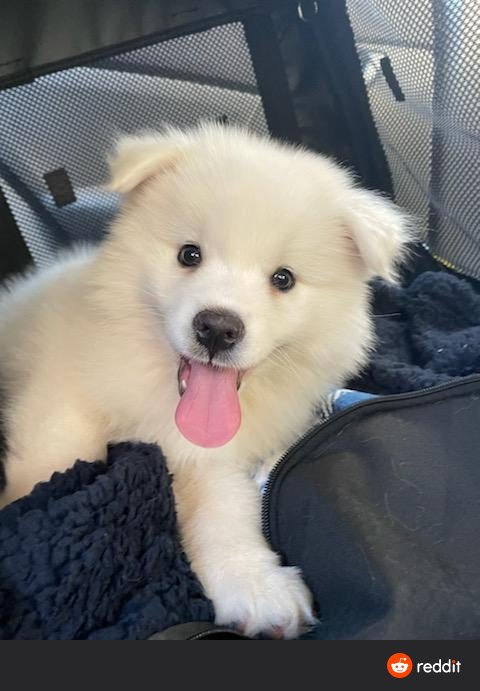
In order to click on blue fuzzy fabric in this screenshot , I will do `click(95, 607)`.